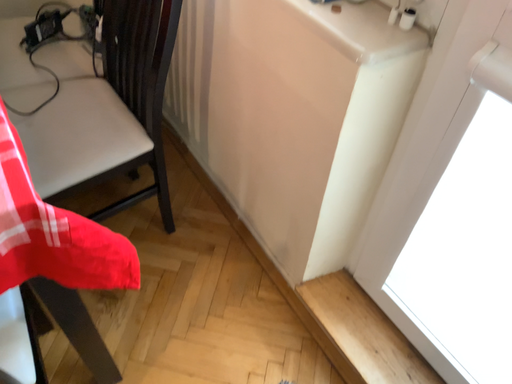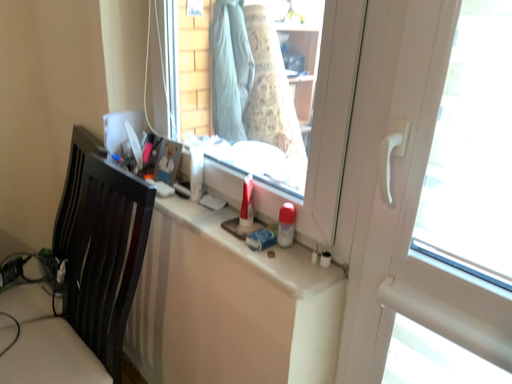
Question: How did the camera likely rotate when shooting the video?

Choices:
 (A) rotated right
 (B) rotated left

Answer: (A)